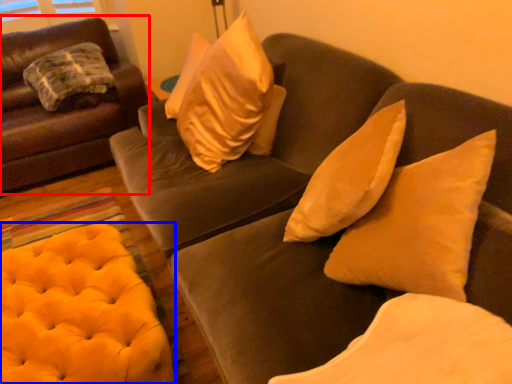
Question: Which of the following is the closest to the observer, studio couch (highlighted by a red box) or stool (highlighted by a blue box)?

Choices:
 (A) studio couch
 (B) stool

Answer: (B)